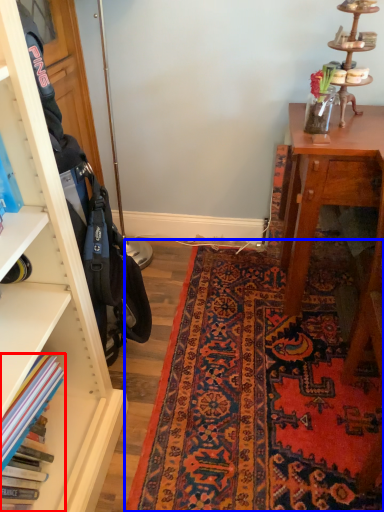
Question: Which object is closer to the camera taking this photo, book (highlighted by a red box) or mat (highlighted by a blue box)?

Choices:
 (A) book
 (B) mat

Answer: (A)